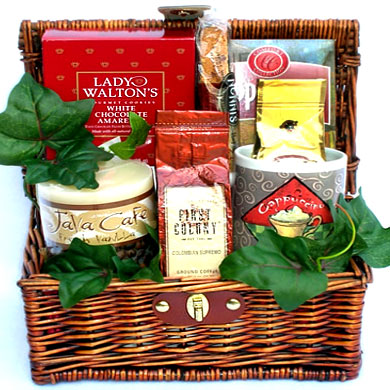
The width and height of the screenshot is (390, 390). In order to click on coffee cup in this screenshot , I will do `click(289, 226)`.